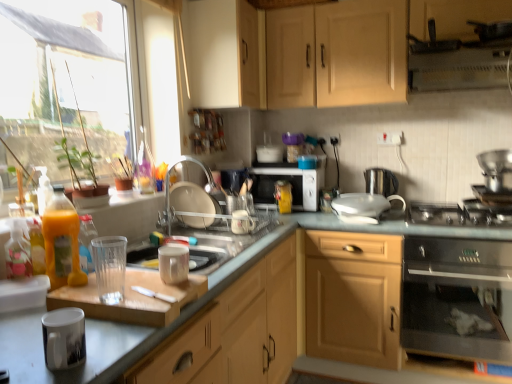
At what (x,y) coordinates should I click in order to perform the action: click on transparent glass window at left. Please return your answer as a coordinate pair (x, y). Image resolution: width=512 pixels, height=384 pixels. Looking at the image, I should click on (62, 79).

What is the approximate width of transparent glass window at left?

→ transparent glass window at left is 2.80 inches in width.

Measure the distance between white glossy mug at sink, which ranks as the 5th appliance in back-to-front order, and camera.

white glossy mug at sink, which ranks as the 5th appliance in back-to-front order, and camera are 6.53 feet apart from each other.

In order to face glossy ceramic mug at lower left, the eighth appliance in the right-to-left sequence, should I rotate leftwards or rightwards?

Rotate your view left by about 24.850°.

How much space does glossy ceramic mug at lower left, the eighth appliance in the right-to-left sequence, occupy horizontally?

glossy ceramic mug at lower left, the eighth appliance in the right-to-left sequence, is 12.83 centimeters in width.

How much space does white glossy kettle at center, arranged as the third appliance when viewed from the right, occupy horizontally?

white glossy kettle at center, arranged as the third appliance when viewed from the right, is 22.88 centimeters in width.

The height and width of the screenshot is (384, 512). I want to click on white glossy kettle at center, the 7th appliance in the front-to-back sequence, so click(362, 207).

This screenshot has width=512, height=384. What do you see at coordinates (225, 53) in the screenshot? I see `white matte cabinet at upper center, the second cabinetry viewed from the top` at bounding box center [225, 53].

Find the location of a particular element. The height and width of the screenshot is (384, 512). stainless steel oven at lower right is located at coordinates (458, 298).

Identify the location of transparent glass window at left. (62, 79).

Which is more to the right, matte wood cabinets at upper center, positioned as the third cabinetry in bottom-to-top order, or white glossy plate at center, which is the 3th appliance from left to right?

matte wood cabinets at upper center, positioned as the third cabinetry in bottom-to-top order.

Between matte wood cabinets at upper center, positioned as the third cabinetry in bottom-to-top order, and white glossy plate at center, which appears as the sixth appliance when viewed from the right, which one has smaller size?

white glossy plate at center, which appears as the sixth appliance when viewed from the right.

Considering the sizes of objects matte wood cabinets at upper center, placed as the first cabinetry when sorted from top to bottom, and white glossy plate at center, which is the 3th appliance from back to front, in the image provided, who is wider, matte wood cabinets at upper center, placed as the first cabinetry when sorted from top to bottom, or white glossy plate at center, which is the 3th appliance from back to front,?

Wider between the two is matte wood cabinets at upper center, placed as the first cabinetry when sorted from top to bottom.

Can you tell me how much matte wood cabinets at upper center, positioned as the third cabinetry in bottom-to-top order, and white glossy plate at center, which appears as the sixth appliance when viewed from the right, differ in facing direction?

There is a 90-degree angle between the facing directions of matte wood cabinets at upper center, positioned as the third cabinetry in bottom-to-top order, and white glossy plate at center, which appears as the sixth appliance when viewed from the right.

Looking at this image, would you say translucent plastic bottle at center, the 1th bottle viewed from the back, is part of white glossy plate at center, which appears as the sixth appliance when viewed from the right,'s contents?

No.

Which is more to the right, white glossy plate at center, which is the 3th appliance from left to right, or translucent plastic bottle at center, the 1th bottle viewed from the back?

translucent plastic bottle at center, the 1th bottle viewed from the back, is more to the right.

Are white glossy plate at center, which appears as the sixth appliance when viewed from the right, and translucent plastic bottle at center, the 3th bottle when ordered from front to back, beside each other?

white glossy plate at center, which appears as the sixth appliance when viewed from the right, and translucent plastic bottle at center, the 3th bottle when ordered from front to back, are clearly separated.

Consider the image. What's the angular difference between translucent plastic bottle at left, which is the second bottle in right-to-left order, and translucent plastic bottle at left, the first bottle viewed from the left,'s facing directions?

The facing directions of translucent plastic bottle at left, which is the second bottle in right-to-left order, and translucent plastic bottle at left, the first bottle viewed from the left, are 0.00507 degrees apart.

Is translucent plastic bottle at left, which is the second bottle in right-to-left order, not close to translucent plastic bottle at left, arranged as the 3th bottle when viewed from the right?

Actually, translucent plastic bottle at left, which is the second bottle in right-to-left order, and translucent plastic bottle at left, arranged as the 3th bottle when viewed from the right, are a little close together.

How distant is translucent plastic bottle at left, arranged as the 2th bottle when viewed from the left, from translucent plastic bottle at left, positioned as the 3th bottle in back-to-front order?

translucent plastic bottle at left, arranged as the 2th bottle when viewed from the left, and translucent plastic bottle at left, positioned as the 3th bottle in back-to-front order, are 10.90 centimeters apart.

Is translucent plastic bottle at left, arranged as the 2th bottle when viewed from the left, closer to the viewer compared to translucent plastic bottle at left, arranged as the 3th bottle when viewed from the right?

No, the depth of translucent plastic bottle at left, arranged as the 2th bottle when viewed from the left, is greater than that of translucent plastic bottle at left, arranged as the 3th bottle when viewed from the right.

Is transparent plastic cup at lower left, placed as the 2th appliance when sorted from left to right, in front of white matte microwave at center?

Yes, the depth of transparent plastic cup at lower left, placed as the 2th appliance when sorted from left to right, is less than that of white matte microwave at center.

Could you tell me if transparent plastic cup at lower left, which appears as the 7th appliance when viewed from the right, is facing white matte microwave at center?

No.

Is transparent plastic cup at lower left, acting as the second appliance starting from the front, not near white matte microwave at center?

Yes, transparent plastic cup at lower left, acting as the second appliance starting from the front, and white matte microwave at center are located far from each other.

From a real-world perspective, is transparent plastic cup at lower left, which appears as the 7th appliance when viewed from the right, physically below white matte microwave at center?

Yes, from a real-world perspective, transparent plastic cup at lower left, which appears as the 7th appliance when viewed from the right, is beneath white matte microwave at center.

Choose the correct answer: Is white glossy plate at center, which is the 3th appliance from left to right, inside metallic silver coffee maker at upper right, acting as the eighth appliance starting from the left, or outside it?

white glossy plate at center, which is the 3th appliance from left to right, lies outside metallic silver coffee maker at upper right, acting as the eighth appliance starting from the left.

Is white glossy plate at center, the sixth appliance from the front, next to metallic silver coffee maker at upper right, the first appliance when ordered from right to left?

No, white glossy plate at center, the sixth appliance from the front, is not touching metallic silver coffee maker at upper right, the first appliance when ordered from right to left.

Which is further, (205, 208) or (498, 192)?

The point (498, 192) is behind.

Could you measure the distance between white glossy plate at center, the sixth appliance from the front, and metallic silver coffee maker at upper right, placed as the 5th appliance when sorted from front to back?

They are 5.41 feet apart.

From the image's perspective, is metallic silver coffee maker at upper right, acting as the eighth appliance starting from the left, on translucent plastic cup at sink, which ranks as the 5th appliance in right-to-left order?

Yes, from the image's perspective, metallic silver coffee maker at upper right, acting as the eighth appliance starting from the left, is above translucent plastic cup at sink, which ranks as the 5th appliance in right-to-left order.

Is point (496, 183) behind point (178, 276)?

Yes, point (496, 183) is behind point (178, 276).

Considering their positions, is metallic silver coffee maker at upper right, which is the fourth appliance from back to front, located in front of or behind translucent plastic cup at sink, the fourth appliance when ordered from left to right?

Clearly, metallic silver coffee maker at upper right, which is the fourth appliance from back to front, is behind translucent plastic cup at sink, the fourth appliance when ordered from left to right.

Looking at this image, is translucent plastic cup at sink, the 6th appliance viewed from the back, surrounded by metallic silver coffee maker at upper right, which is the fourth appliance from back to front?

No, translucent plastic cup at sink, the 6th appliance viewed from the back, is not surrounded by metallic silver coffee maker at upper right, which is the fourth appliance from back to front.

Is white glossy mug at sink, which is the fifth appliance from left to right, wider or thinner than white matte microwave at center?

white glossy mug at sink, which is the fifth appliance from left to right, is thinner than white matte microwave at center.

Which object is closer to the camera taking this photo, white glossy mug at sink, which is the fifth appliance from left to right, or white matte microwave at center?

white glossy mug at sink, which is the fifth appliance from left to right, is closer to the camera.

Is point (250, 224) closer to camera compared to point (254, 167)?

Yes.

From the image's perspective, is white glossy mug at sink, which is the fifth appliance from left to right, beneath white matte microwave at center?

Indeed, from the image's perspective, white glossy mug at sink, which is the fifth appliance from left to right, is shown beneath white matte microwave at center.

Find the location of a particular element. cabinetry that is the 3rd one when counting rightward from the white glossy plate at center, which is the 3th appliance from back to front is located at coordinates (337, 54).

This screenshot has width=512, height=384. I want to click on appliance that is the 1st one above the translucent plastic bottle at center, the 1th bottle viewed from the back (from a real-world perspective), so click(x=192, y=199).

When comparing their distances from white glossy plate at center, which is the 3th appliance from left to right, does metallic silver coffee maker at upper right, which is the fourth appliance from back to front, or white matte microwave at center seem further?

metallic silver coffee maker at upper right, which is the fourth appliance from back to front, is positioned further to the anchor white glossy plate at center, which is the 3th appliance from left to right.

From the image, which object appears to be farther from silver metallic kettle at right, the 7th appliance positioned from the left, metallic silver coffee maker at upper right, acting as the eighth appliance starting from the left, or stainless steel oven at lower right?

The object further to silver metallic kettle at right, the 7th appliance positioned from the left, is stainless steel oven at lower right.

From the image, which object appears to be nearer to metallic silver coffee maker at upper right, which is the fourth appliance from back to front, white matte microwave at center or silver metallic kettle at right, the 7th appliance positioned from the left?

Based on the image, silver metallic kettle at right, the 7th appliance positioned from the left, appears to be nearer to metallic silver coffee maker at upper right, which is the fourth appliance from back to front.

Looking at this image, estimate the real-world distances between objects in this image. Which object is further from glossy ceramic mug at lower left, placed as the eighth appliance when sorted from back to front, translucent plastic cup at sink, the 6th appliance viewed from the back, or white matte microwave at center?

Based on the image, white matte microwave at center appears to be further to glossy ceramic mug at lower left, placed as the eighth appliance when sorted from back to front.

From the image, which object appears to be farther from white glossy kettle at center, acting as the 2th appliance starting from the back, matte wood cabinets at upper center, positioned as the third cabinetry in bottom-to-top order, or white glossy plate at center, which appears as the sixth appliance when viewed from the right?

white glossy plate at center, which appears as the sixth appliance when viewed from the right.

Considering their positions, is white glossy faucet at center positioned further to white glossy plate at center, which appears as the sixth appliance when viewed from the right, than white glossy mug at sink, the 4th appliance in the right-to-left sequence?

white glossy mug at sink, the 4th appliance in the right-to-left sequence, is positioned further to the anchor white glossy plate at center, which appears as the sixth appliance when viewed from the right.

Considering their positions, is white glossy plate at center, which is the 3th appliance from back to front, positioned closer to translucent plastic bottle at left, arranged as the 2th bottle when viewed from the left, than glossy ceramic mug at lower left, the eighth appliance in the right-to-left sequence?

Based on the image, glossy ceramic mug at lower left, the eighth appliance in the right-to-left sequence, appears to be nearer to translucent plastic bottle at left, arranged as the 2th bottle when viewed from the left.

Estimate the real-world distances between objects in this image. Which object is closer to matte wood cabinets at upper center, placed as the first cabinetry when sorted from top to bottom, white glossy kettle at center, acting as the 2th appliance starting from the back, or silver metallic kettle at right, the 1th appliance viewed from the back?

Among the two, silver metallic kettle at right, the 1th appliance viewed from the back, is located nearer to matte wood cabinets at upper center, placed as the first cabinetry when sorted from top to bottom.

The width and height of the screenshot is (512, 384). In order to click on faucet situated between translucent plastic bottle at left, which is the second bottle in right-to-left order, and stainless steel gas stove at lower right from left to right in this screenshot , I will do `click(190, 198)`.

Identify the location of cabinetry that lies between matte wood cabinets at upper center, placed as the first cabinetry when sorted from top to bottom, and white glossy mug at sink, the 4th appliance in the right-to-left sequence, from top to bottom. (225, 53).

The height and width of the screenshot is (384, 512). Find the location of `faucet between transparent plastic cup at lower left, which appears as the 7th appliance when viewed from the right, and white glossy plate at center, which appears as the sixth appliance when viewed from the right, from front to back`. faucet between transparent plastic cup at lower left, which appears as the 7th appliance when viewed from the right, and white glossy plate at center, which appears as the sixth appliance when viewed from the right, from front to back is located at coordinates (190, 198).

Locate an element on the screen. kitchen appliance between white glossy plate at center, which appears as the sixth appliance when viewed from the right, and stainless steel gas stove at lower right, in the horizontal direction is located at coordinates (458, 298).